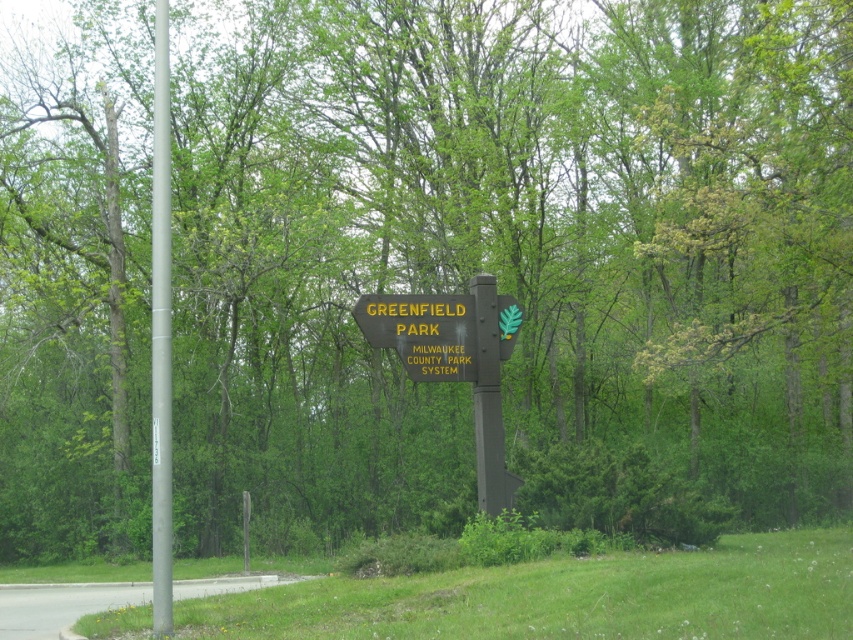
Question: Which point is farther to the camera?

Choices:
 (A) (364, 328)
 (B) (163, 49)
 (C) (492, 385)

Answer: (C)

Question: Which of the following is the farthest from the observer?

Choices:
 (A) (497, 355)
 (B) (158, 8)
 (C) (480, 349)

Answer: (A)

Question: Can you confirm if silver metallic pole at left is thinner than black metal signpost at center?

Choices:
 (A) no
 (B) yes

Answer: (A)

Question: Which is nearer to the wooden sign at center?

Choices:
 (A) wooden signboard at center
 (B) black metal signpost at center
 (C) silver metallic pole at left

Answer: (A)

Question: Is silver metallic pole at left bigger than black metal signpost at center?

Choices:
 (A) yes
 (B) no

Answer: (A)

Question: Can you confirm if wooden signboard at center is bigger than black metal signpost at center?

Choices:
 (A) yes
 (B) no

Answer: (A)